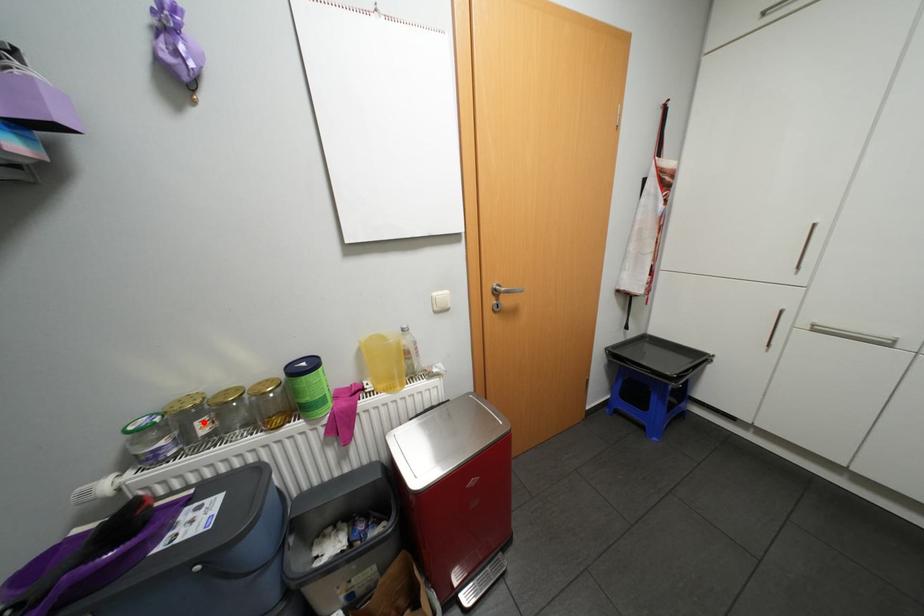
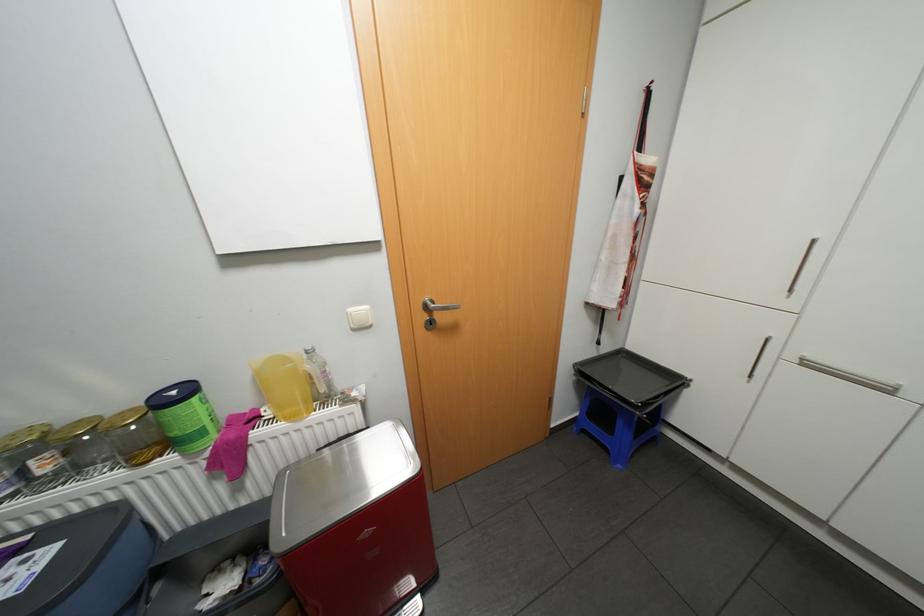
Question: I am providing you with two images of the same scene from different viewpoints. In image1, a red point is highlighted. Considering the same 3D point in image2, which of the following is correct?

Choices:
 (A) It is closer
 (B) It is farther

Answer: (A)